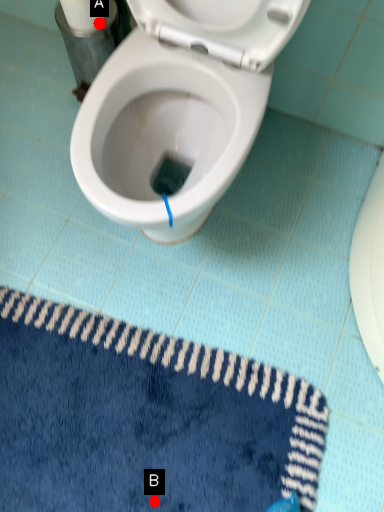
Question: Two points are circled on the image, labeled by A and B beside each circle. Which of the following is the closest to the observer?

Choices:
 (A) A is closer
 (B) B is closer

Answer: (B)